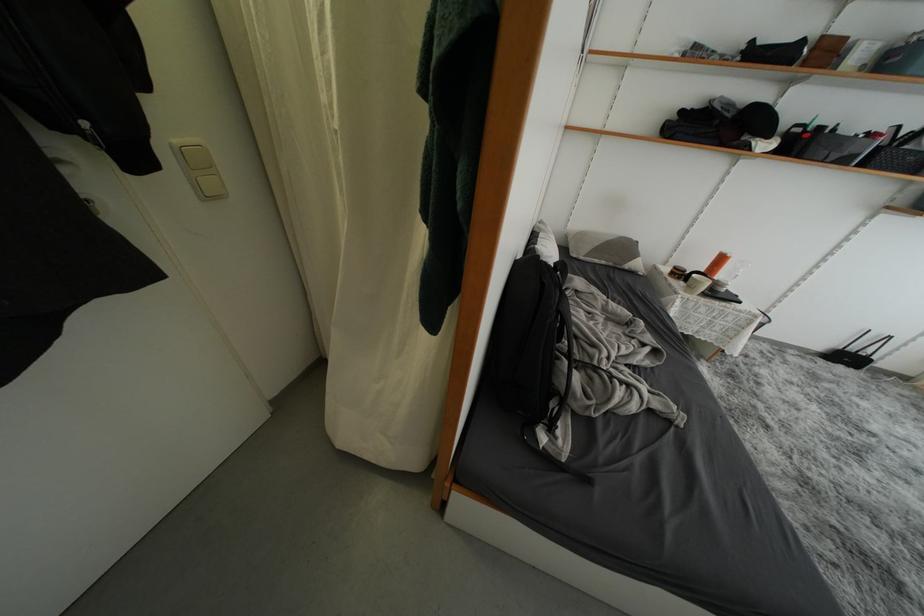
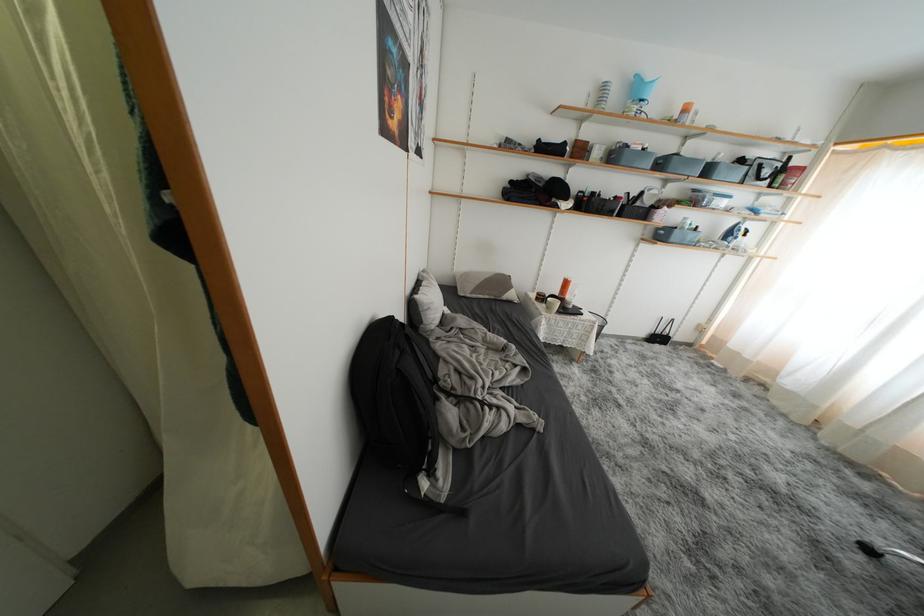
Find the pixel in the second image that matches (x=564, y=297) in the first image.

(404, 357)